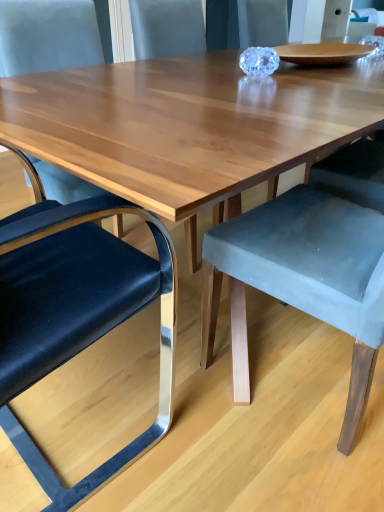
Locate an element on the screen. This screenshot has width=384, height=512. vacant area situated below velvet grey chair at center, which appears as the 1th chair when viewed from the right (from a real-world perspective) is located at coordinates (302, 370).